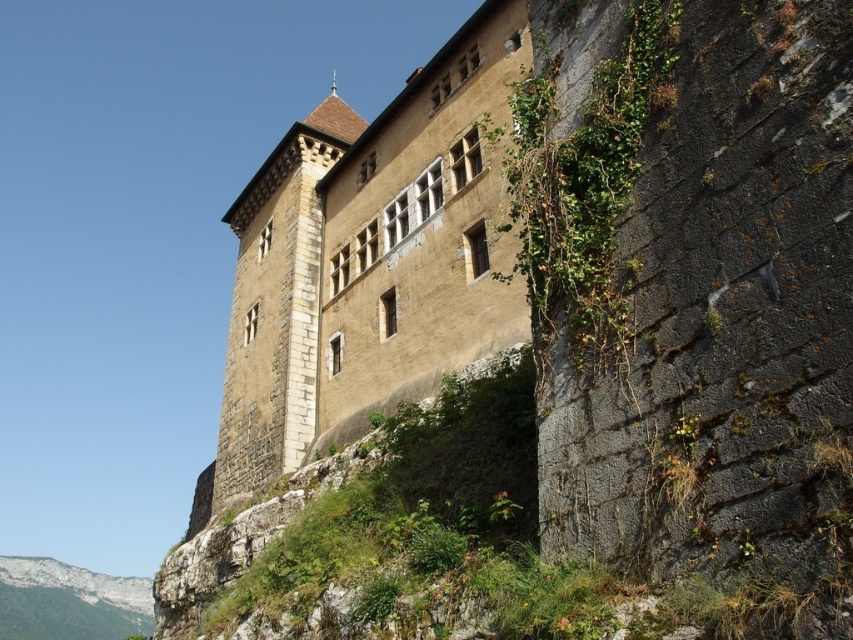
You are standing in front of the historic stone building and want to take a photo. You notice two points marked on the building. The first point is at coordinate point (376,188) and the second is at point (316,413). Which point is closer to your camera?

Point (376,188) is further to the camera than point (316,413), so the second point is closer to your camera.